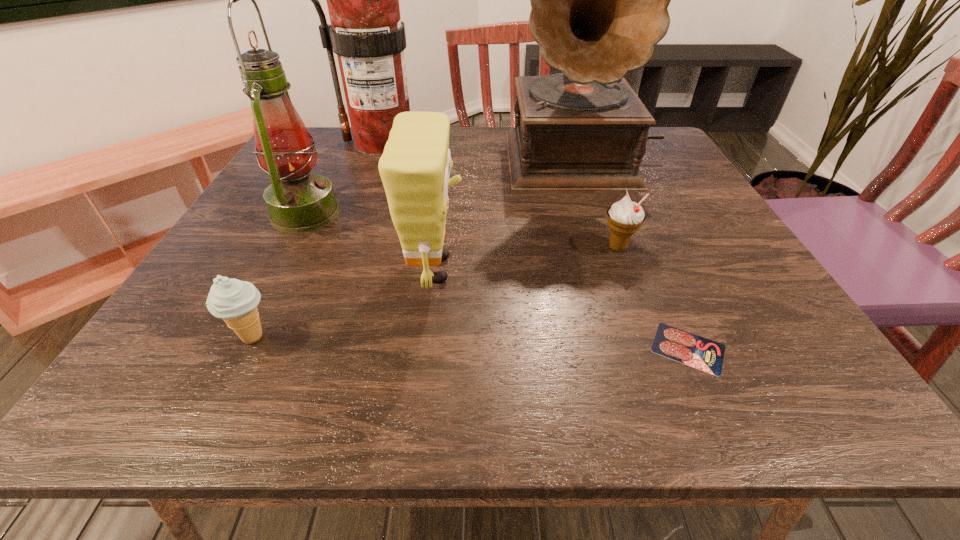
Find the location of `record player at the right edge`. record player at the right edge is located at coordinates (599, 0).

Locate an element on the screen. The height and width of the screenshot is (540, 960). salami positioned at the right edge is located at coordinates (701, 353).

I want to click on object situated at the far left corner, so point(366,32).

Identify the location of object situated at the far right corner. The image size is (960, 540). (599, 0).

You are a GUI agent. You are given a task and a screenshot of the screen. Output one action in this format:
    pyautogui.click(x=<x>, y=<y>)
    Task: Click on the object at the near right corner
    
    Given the screenshot: What is the action you would take?
    pyautogui.click(x=701, y=353)

Locate an element on the screen. This screenshot has height=540, width=960. free region at the far edge of the desktop is located at coordinates (496, 170).

I want to click on vacant space at the near edge, so click(x=572, y=379).

In the image, there is a desktop. At what (x,y) coordinates should I click in order to perform the action: click on free space at the left edge. Please return your answer as a coordinate pair (x, y). Looking at the image, I should click on pos(251,279).

The height and width of the screenshot is (540, 960). Identify the location of blank area at the right edge. 690,225.

Locate an element on the screen. vacant region at the far left corner of the desktop is located at coordinates (318, 163).